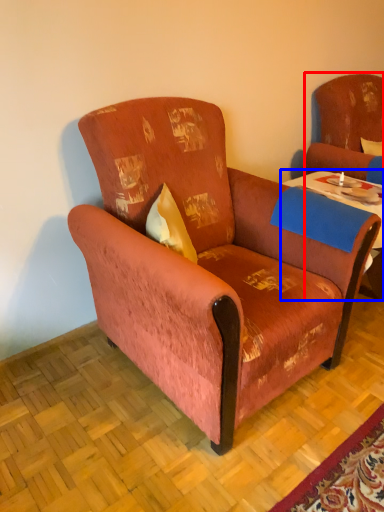
Question: Which object appears farthest to the camera in this image, swivel chair (highlighted by a red box) or table (highlighted by a blue box)?

Choices:
 (A) swivel chair
 (B) table

Answer: (A)